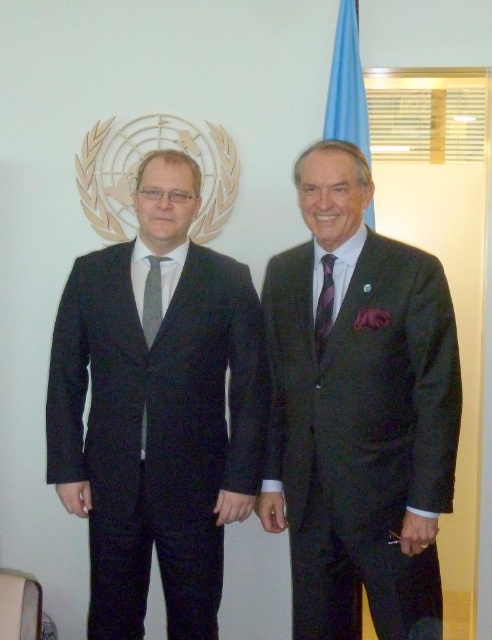
Question: Which object appears farthest from the camera in this image?

Choices:
 (A) gray textured tie at left
 (B) dark grey textured suit at right
 (C) black wool suit at center
 (D) purple striped tie at right

Answer: (A)

Question: Which point is closer to the camera taking this photo?

Choices:
 (A) (328, 324)
 (B) (130, 625)
 (C) (157, 324)

Answer: (A)

Question: Is black wool suit at center thinner than gray textured tie at left?

Choices:
 (A) yes
 (B) no

Answer: (B)

Question: Is dark grey textured suit at right in front of gray textured tie at left?

Choices:
 (A) no
 (B) yes

Answer: (B)

Question: Estimate the real-world distances between objects in this image. Which object is closer to the purple striped tie at right?

Choices:
 (A) gray textured tie at left
 (B) black wool suit at center
 (C) dark grey textured suit at right

Answer: (C)

Question: Is gray textured tie at left further to the viewer compared to purple striped tie at right?

Choices:
 (A) no
 (B) yes

Answer: (B)